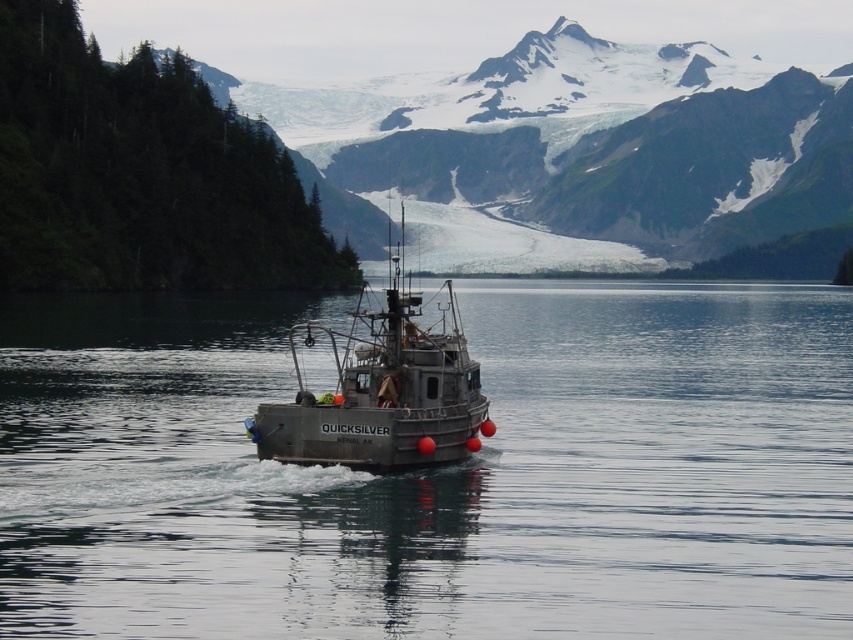
You are a photographer planning to capture the fjord scene. You notice the clear water at center and the snowy granite mountain at upper center in your viewfinder. Which object appears narrower in the image?

The clear water at center appears narrower than the snowy granite mountain at upper center.

Consider the image. You are a marine biologist studying water clarity in the fjord. You observe the clear water at center from your boat. Based on its position coordinates, can you determine if it is located in the upper half or lower half of the image?

The clear water at center is located at coordinates point (x=436, y=472). Since the y coordinate is 0.512, which is above the midpoint of 0.5, it is in the upper half of the image.

You are a photographer planning to take a photo of the gray metallic fishing boat at center and the clear water at center. Based on their positions, which object should you focus on first if you want to capture both in a single shot without adjusting your camera focus?

The gray metallic fishing boat at center is located above the clear water at center, so you should focus on the gray metallic fishing boat at center first to ensure both are in focus since it is closer to the camera.